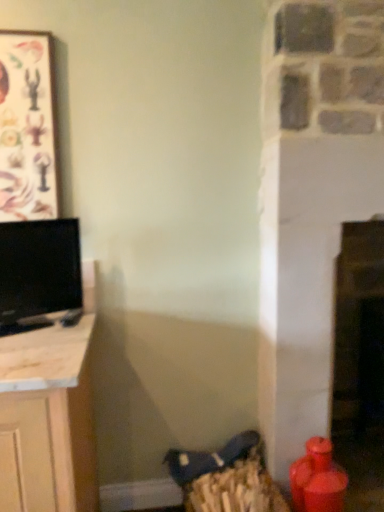
Locate an element on the screen. Image resolution: width=384 pixels, height=512 pixels. black glossy tv at left is located at coordinates (38, 272).

The width and height of the screenshot is (384, 512). What do you see at coordinates (38, 272) in the screenshot? I see `black glossy tv at left` at bounding box center [38, 272].

What is the approximate width of black glossy tv at left?

The width of black glossy tv at left is 4.19 inches.

What do you see at coordinates (27, 128) in the screenshot? This screenshot has height=512, width=384. I see `wooden frame at upper left` at bounding box center [27, 128].

Where is `wooden frame at upper left`? This screenshot has height=512, width=384. wooden frame at upper left is located at coordinates (27, 128).

Locate an element on the screen. This screenshot has width=384, height=512. black glossy tv at left is located at coordinates (38, 272).

Would you say black glossy tv at left is to the left or to the right of wooden frame at upper left in the picture?

Clearly, black glossy tv at left is on the right of wooden frame at upper left in the image.

Between black glossy tv at left and wooden frame at upper left, which one is positioned in front?

black glossy tv at left is more forward.

Considering the points (14, 258) and (39, 42), which point is behind, point (14, 258) or point (39, 42)?

Point (39, 42)

From the image's perspective, is black glossy tv at left below wooden frame at upper left?

Yes, from the image's perspective, black glossy tv at left is below wooden frame at upper left.

From a real-world perspective, is black glossy tv at left above or below wooden frame at upper left?

black glossy tv at left is below wooden frame at upper left.

Considering the sizes of black glossy tv at left and wooden frame at upper left in the image, is black glossy tv at left wider or thinner than wooden frame at upper left?

In the image, black glossy tv at left appears to be wider than wooden frame at upper left.

Considering the sizes of objects black glossy tv at left and wooden frame at upper left in the image provided, who is shorter, black glossy tv at left or wooden frame at upper left?

black glossy tv at left is shorter.

Which of these two, black glossy tv at left or wooden frame at upper left, is smaller?

With smaller size is wooden frame at upper left.

Is wooden frame at upper left completely or partially inside black glossy tv at left?

No, wooden frame at upper left is located outside of black glossy tv at left.

Is there a large distance between black glossy tv at left and wooden frame at upper left?

No, black glossy tv at left is not far from wooden frame at upper left.

Does black glossy tv at left turn towards wooden frame at upper left?

No.

Consider the image. What's the angular difference between black glossy tv at left and wooden frame at upper left's facing directions?

The angular difference between black glossy tv at left and wooden frame at upper left is 28.4 degrees.

Where is `television below the wooden frame at upper left (from the image's perspective)`? This screenshot has width=384, height=512. television below the wooden frame at upper left (from the image's perspective) is located at coordinates (38, 272).

In the image, is wooden frame at upper left on the left side or the right side of black glossy tv at left?

Clearly, wooden frame at upper left is on the left of black glossy tv at left in the image.

Is wooden frame at upper left in front of or behind black glossy tv at left in the image?

Clearly, wooden frame at upper left is behind black glossy tv at left.

Is point (18, 156) farther from viewer compared to point (31, 293)?

Yes, it is.

From the image's perspective, is wooden frame at upper left above or below black glossy tv at left?

wooden frame at upper left is above black glossy tv at left.

From a real-world perspective, is wooden frame at upper left on top of black glossy tv at left?

Yes.

Which of these two, wooden frame at upper left or black glossy tv at left, is thinner?

wooden frame at upper left is thinner.

In the scene shown: Does wooden frame at upper left have a lesser height compared to black glossy tv at left?

Incorrect, the height of wooden frame at upper left does not fall short of that of black glossy tv at left.

Does wooden frame at upper left have a larger size compared to black glossy tv at left?

Actually, wooden frame at upper left might be smaller than black glossy tv at left.

Do you think wooden frame at upper left is within black glossy tv at left, or outside of it?

wooden frame at upper left is located beyond the bounds of black glossy tv at left.

Are wooden frame at upper left and black glossy tv at left beside each other?

wooden frame at upper left and black glossy tv at left are not in contact.

Is wooden frame at upper left facing away from black glossy tv at left?

No, wooden frame at upper left is not facing away from black glossy tv at left.

What's the angular difference between wooden frame at upper left and black glossy tv at left's facing directions?

They differ by 28.4 degrees in their facing directions.

The height and width of the screenshot is (512, 384). Identify the location of television below the wooden frame at upper left (from the image's perspective). (38, 272).

You are a GUI agent. You are given a task and a screenshot of the screen. Output one action in this format:
    pyautogui.click(x=<x>, y=<y>)
    Task: Click on the picture frame that appears above the black glossy tv at left (from a real-world perspective)
    The width and height of the screenshot is (384, 512).
    Given the screenshot: What is the action you would take?
    pyautogui.click(x=27, y=128)

Locate an element on the screen. The height and width of the screenshot is (512, 384). picture frame above the black glossy tv at left (from the image's perspective) is located at coordinates (27, 128).